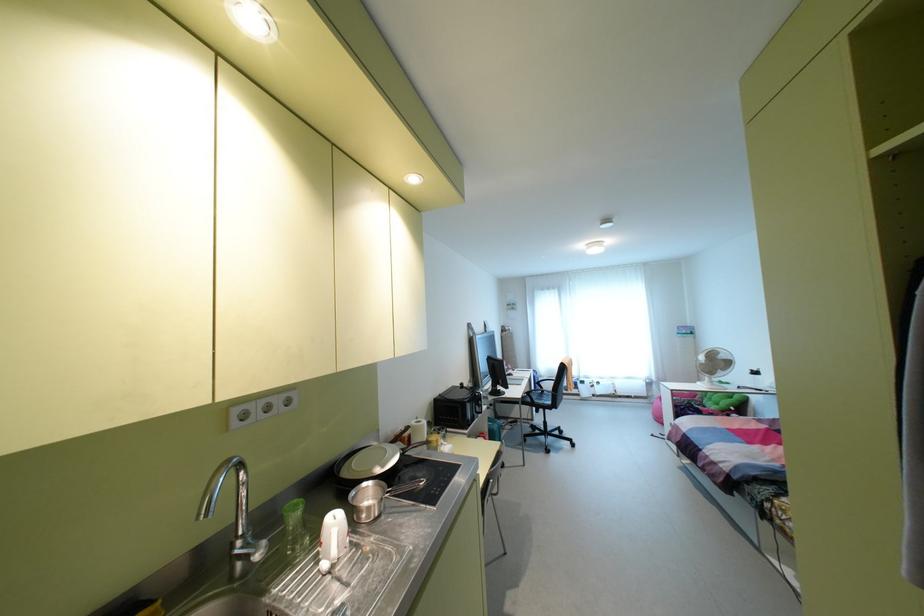
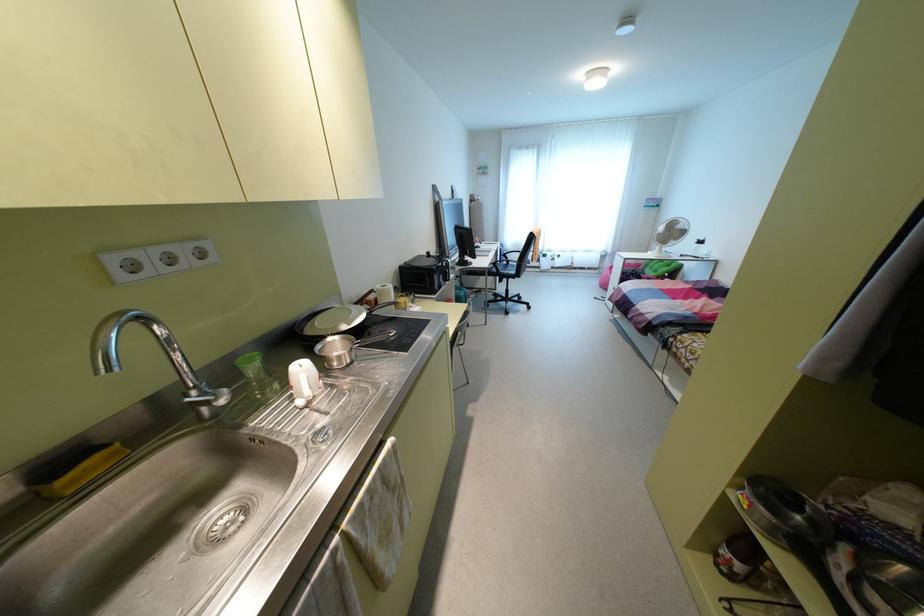
In the second image, find the point that corresponds to the point at 294,515 in the first image.

(251, 366)